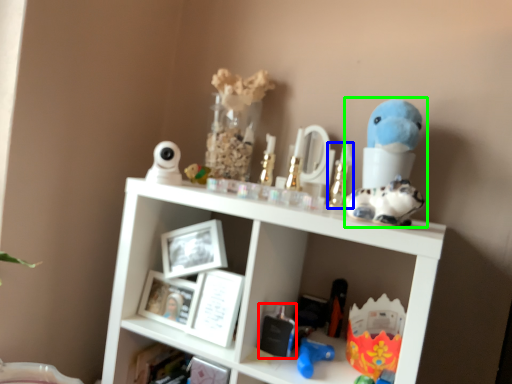
Question: Which is nearer to the toy (highlighted by a red box)? toy (highlighted by a blue box) or figurine (highlighted by a green box).

Choices:
 (A) toy
 (B) figurine

Answer: (A)